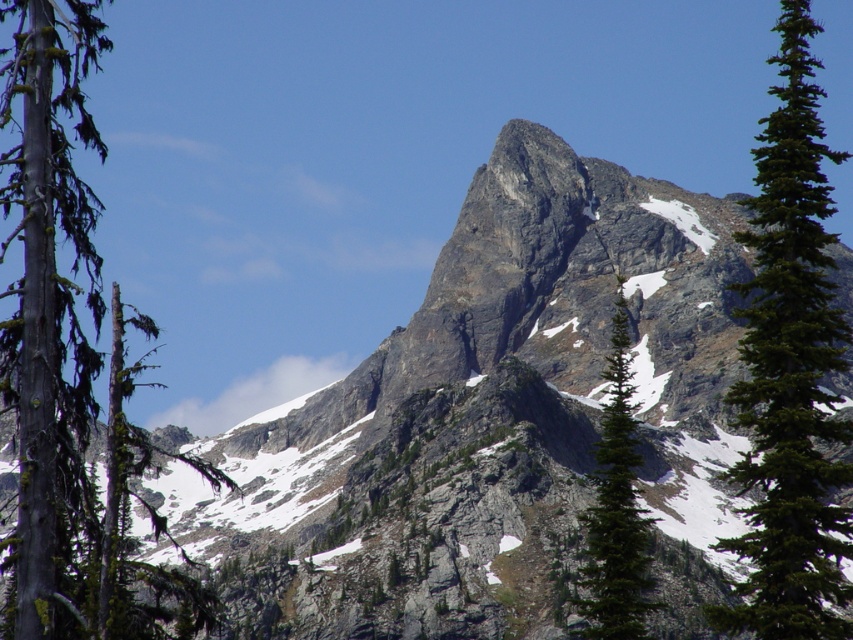
Question: Does green mossy tree trunk at left lie in front of green textured pine tree at center?

Choices:
 (A) no
 (B) yes

Answer: (B)

Question: Can you confirm if green mossy tree trunk at left is thinner than green coniferous tree at right?

Choices:
 (A) no
 (B) yes

Answer: (A)

Question: Which object is closer to the camera taking this photo?

Choices:
 (A) green textured pine tree at center
 (B) green mossy tree trunk at left

Answer: (B)

Question: Which point is farther to the camera?

Choices:
 (A) green textured pine tree at center
 (B) green mossy tree trunk at left

Answer: (A)

Question: Which object is positioned farthest from the green textured pine tree at center?

Choices:
 (A) green mossy tree trunk at left
 (B) green coniferous tree at right

Answer: (A)

Question: Does green mossy tree trunk at left have a greater width compared to green textured pine tree at center?

Choices:
 (A) no
 (B) yes

Answer: (B)